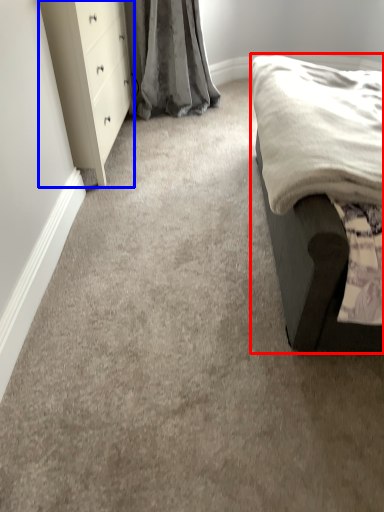
Question: Which of the following is the closest to the observer, furniture (highlighted by a red box) or chest of drawers (highlighted by a blue box)?

Choices:
 (A) furniture
 (B) chest of drawers

Answer: (A)